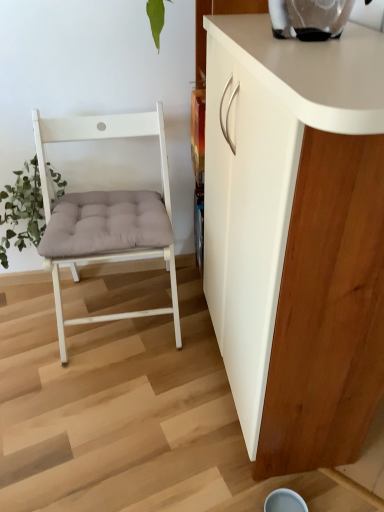
Question: Can you confirm if white matte cabinet at right is taller than green fuzzy plant at left?

Choices:
 (A) yes
 (B) no

Answer: (A)

Question: Is white matte cabinet at right oriented away from green fuzzy plant at left?

Choices:
 (A) no
 (B) yes

Answer: (A)

Question: From a real-world perspective, does white matte cabinet at right stand above green fuzzy plant at left?

Choices:
 (A) no
 (B) yes

Answer: (B)

Question: Does white matte cabinet at right appear on the left side of green fuzzy plant at left?

Choices:
 (A) no
 (B) yes

Answer: (A)

Question: Does white matte cabinet at right have a smaller size compared to green fuzzy plant at left?

Choices:
 (A) yes
 (B) no

Answer: (B)

Question: Considering the positions of green fuzzy plant at left and white matte cabinet at right in the image, is green fuzzy plant at left bigger or smaller than white matte cabinet at right?

Choices:
 (A) big
 (B) small

Answer: (B)

Question: From a real-world perspective, relative to white matte cabinet at right, is green fuzzy plant at left vertically above or below?

Choices:
 (A) above
 (B) below

Answer: (B)

Question: Considering the positions of green fuzzy plant at left and white matte cabinet at right in the image, is green fuzzy plant at left taller or shorter than white matte cabinet at right?

Choices:
 (A) short
 (B) tall

Answer: (A)

Question: From the image's perspective, is green fuzzy plant at left above or below white matte cabinet at right?

Choices:
 (A) above
 (B) below

Answer: (A)

Question: Is white wood chair at left taller or shorter than green fuzzy plant at left?

Choices:
 (A) short
 (B) tall

Answer: (B)

Question: Looking at their shapes, would you say white wood chair at left is wider or thinner than green fuzzy plant at left?

Choices:
 (A) wide
 (B) thin

Answer: (A)

Question: Based on their sizes in the image, would you say white wood chair at left is bigger or smaller than green fuzzy plant at left?

Choices:
 (A) small
 (B) big

Answer: (B)

Question: Is point (56, 248) closer or farther from the camera than point (18, 183)?

Choices:
 (A) farther
 (B) closer

Answer: (B)

Question: Choose the correct answer: Is white wood chair at left inside white matte cabinet at right or outside it?

Choices:
 (A) inside
 (B) outside

Answer: (B)

Question: From a real-world perspective, is white wood chair at left physically located above or below white matte cabinet at right?

Choices:
 (A) above
 (B) below

Answer: (B)